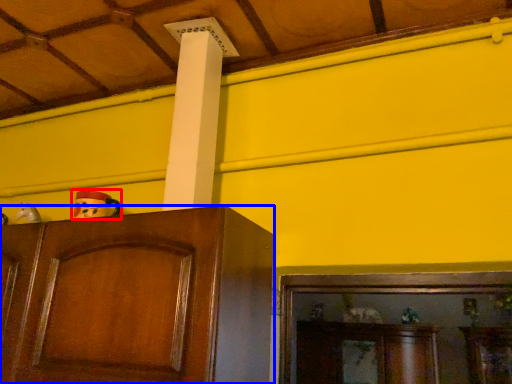
Question: Which point is further to the camera, toy (highlighted by a red box) or cabinetry (highlighted by a blue box)?

Choices:
 (A) toy
 (B) cabinetry

Answer: (A)